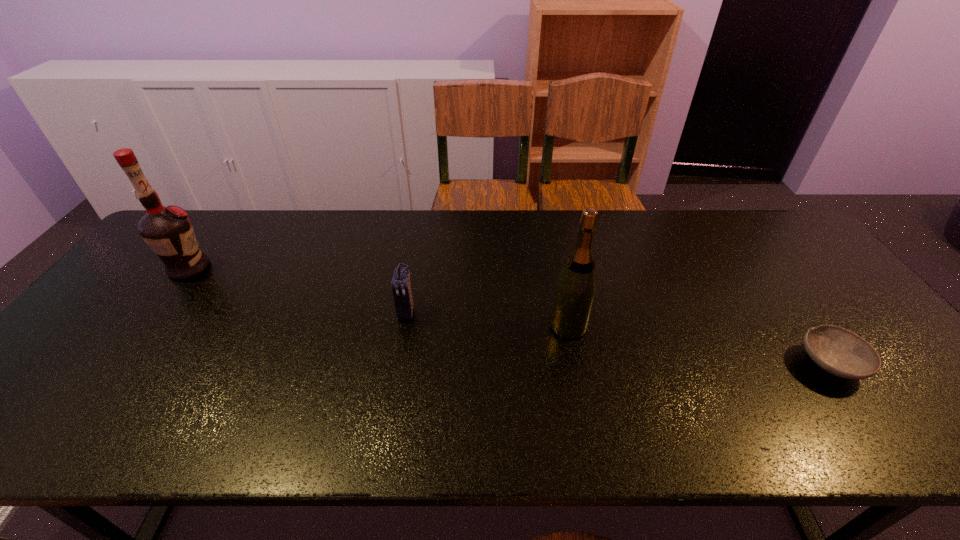
At what (x,y) coordinates should I click in order to perform the action: click on vacant space located 0.300m on the front-facing side of the wine bottle. Please return your answer as a coordinate pair (x, y). This screenshot has width=960, height=540. Looking at the image, I should click on (435, 326).

I want to click on free spot located 0.120m with the zip open on the second shortest object, so click(x=398, y=362).

The height and width of the screenshot is (540, 960). I want to click on free space located on the left of the rightmost object, so click(x=703, y=364).

The image size is (960, 540). Find the location of `object situated at the left edge`. object situated at the left edge is located at coordinates click(x=168, y=231).

You are a GUI agent. You are given a task and a screenshot of the screen. Output one action in this format:
    pyautogui.click(x=<x>, y=<y>)
    Task: Click on the object present at the right edge
    The height and width of the screenshot is (540, 960).
    Given the screenshot: What is the action you would take?
    pyautogui.click(x=838, y=351)

Find the location of a particular element. The height and width of the screenshot is (540, 960). vacant space at the far edge of the desktop is located at coordinates (731, 249).

Identify the location of vacant region at the near edge. (513, 413).

Identify the location of vacant area at the left edge of the desktop. (54, 360).

The width and height of the screenshot is (960, 540). In the image, there is a desktop. What are the coordinates of `vacant space at the right edge` in the screenshot? It's located at (874, 394).

Identify the location of free space at the far right corner of the desktop. (751, 213).